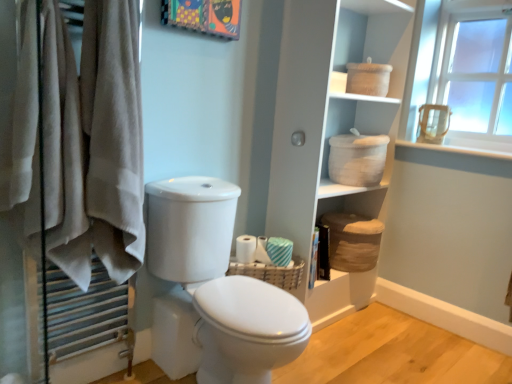
The image size is (512, 384). I want to click on vacant space to the right of white woven baskets at upper center, so click(401, 325).